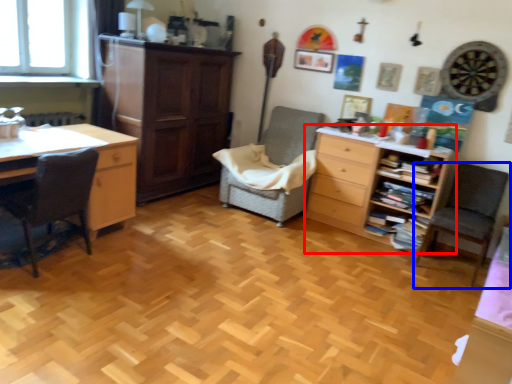
Question: Among these objects, which one is farthest to the camera, chest of drawers (highlighted by a red box) or chair (highlighted by a blue box)?

Choices:
 (A) chest of drawers
 (B) chair

Answer: (A)